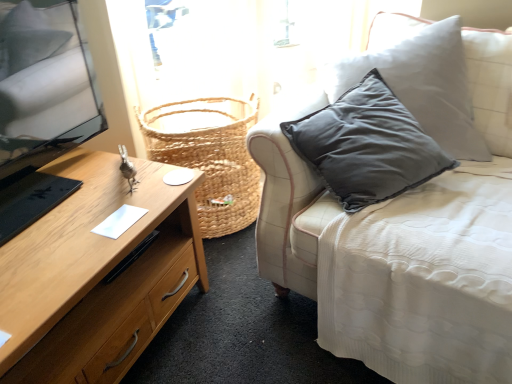
Question: From the image's perspective, is white fabric couch at center located above or below wooden desk at left?

Choices:
 (A) below
 (B) above

Answer: (B)

Question: Is white fabric couch at center to the left or to the right of wooden desk at left in the image?

Choices:
 (A) left
 (B) right

Answer: (B)

Question: Based on their relative distances, which object is farther from the woven natural basket at center?

Choices:
 (A) wooden desk at left
 (B) white fabric couch at center

Answer: (B)

Question: Estimate the real-world distances between objects in this image. Which object is closer to the woven natural basket at center?

Choices:
 (A) wooden desk at left
 (B) white fabric couch at center

Answer: (A)